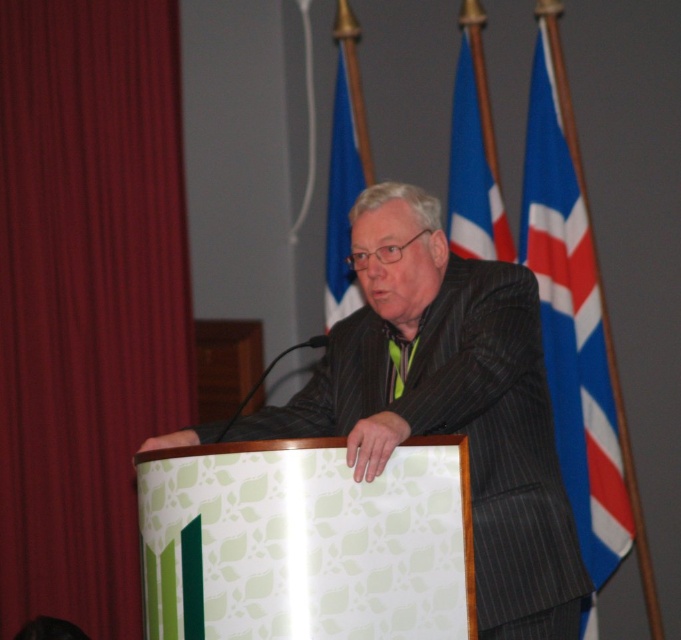
You are a photographer at the event and need to capture a clear photo of the speaker. The blue fabric flag at right and the green satin tie at center are both in the frame. Since the flag is larger, will it block the view of the tie?

The blue fabric flag at right is larger in size than the green satin tie at center, so it may block the view of the green satin tie at center depending on their positions.

You are a photographer standing at the front of the event venue. You need to take a photo that includes both the man at the podium and the blue fabric flag at right. The camera you are using has a maximum focus range of 3 meters. Can you capture both subjects in focus without moving your position?

The blue fabric flag at right is 3.64 meters away from the viewer. Since the camera can only focus up to 3 meters, it cannot capture both the man at the podium and the blue fabric flag at right in focus without moving.

You are a photographer at the event and need to capture both the blue fabric flag at right and the blue fabric flag at upper center in a single frame. Which flag should you focus on to ensure both are visible without zooming in or out?

The blue fabric flag at right is bigger than the blue fabric flag at upper center, so focusing on the blue fabric flag at right will help ensure both flags are visible in the frame without needing to adjust the zoom.